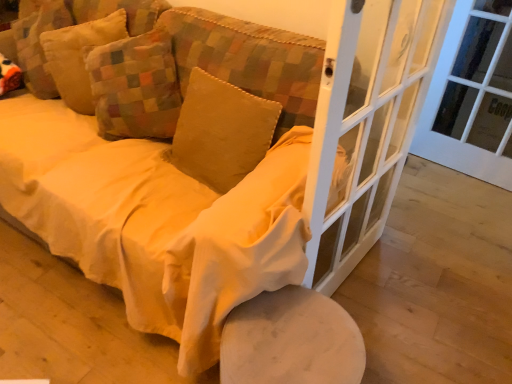
Question: In the image, is white glass door at right positioned in front of or behind white glass screen door at center right?

Choices:
 (A) behind
 (B) front

Answer: (A)

Question: Is point (453, 36) positioned closer to the camera than point (378, 67)?

Choices:
 (A) closer
 (B) farther

Answer: (B)

Question: Which of these objects is positioned closest to the white marble stool at lower center?

Choices:
 (A) velvet yellow pillow at upper left, the 3th pillow in the right-to-left sequence
 (B) white glass door at right
 (C) white glass screen door at center right
 (D) velvet yellow pillow at upper left, acting as the second pillow starting from the left
 (E) velvet yellow couch at center

Answer: (E)

Question: Estimate the real-world distances between objects in this image. Which object is closer to the velvet yellow pillow at center, which is the first pillow in right-to-left order?

Choices:
 (A) white glass screen door at center right
 (B) velvet yellow pillow at upper left, the 3th pillow in the right-to-left sequence
 (C) white marble stool at lower center
 (D) velvet yellow couch at center
 (E) velvet yellow pillow at upper left, acting as the second pillow starting from the left

Answer: (D)